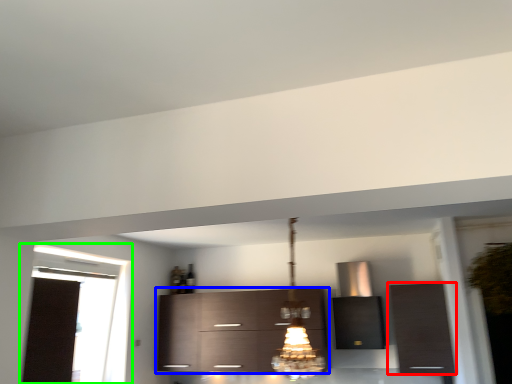
Question: Estimate the real-world distances between objects in this image. Which object is farther from cabinetry (highlighted by a red box), cabinetry (highlighted by a blue box) or window (highlighted by a green box)?

Choices:
 (A) cabinetry
 (B) window

Answer: (B)